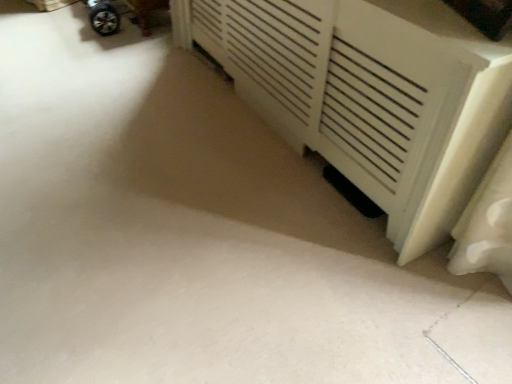
Question: Considering the relative sizes of metallic silver wheel at upper left and white matte radiator at center in the image provided, is metallic silver wheel at upper left smaller than white matte radiator at center?

Choices:
 (A) no
 (B) yes

Answer: (B)

Question: Is white matte radiator at center at the back of metallic silver wheel at upper left?

Choices:
 (A) yes
 (B) no

Answer: (B)

Question: From the image's perspective, is metallic silver wheel at upper left on top of white matte radiator at center?

Choices:
 (A) yes
 (B) no

Answer: (A)

Question: Is metallic silver wheel at upper left outside of white matte radiator at center?

Choices:
 (A) no
 (B) yes

Answer: (B)

Question: From a real-world perspective, does metallic silver wheel at upper left sit lower than white matte radiator at center?

Choices:
 (A) no
 (B) yes

Answer: (B)

Question: Does metallic silver wheel at upper left come behind white matte radiator at center?

Choices:
 (A) yes
 (B) no

Answer: (A)

Question: Is white matte radiator at center looking in the opposite direction of metallic silver wheel at upper left?

Choices:
 (A) no
 (B) yes

Answer: (A)

Question: Could you tell me if white matte radiator at center is turned towards metallic silver wheel at upper left?

Choices:
 (A) yes
 (B) no

Answer: (B)

Question: From the image's perspective, does white matte radiator at center appear higher than metallic silver wheel at upper left?

Choices:
 (A) yes
 (B) no

Answer: (B)

Question: From a real-world perspective, is white matte radiator at center beneath metallic silver wheel at upper left?

Choices:
 (A) no
 (B) yes

Answer: (A)

Question: Does white matte radiator at center come in front of metallic silver wheel at upper left?

Choices:
 (A) yes
 (B) no

Answer: (A)

Question: Would you say metallic silver wheel at upper left is part of white matte radiator at center's contents?

Choices:
 (A) yes
 (B) no

Answer: (B)

Question: Is white matte radiator at center bigger or smaller than metallic silver wheel at upper left?

Choices:
 (A) big
 (B) small

Answer: (A)